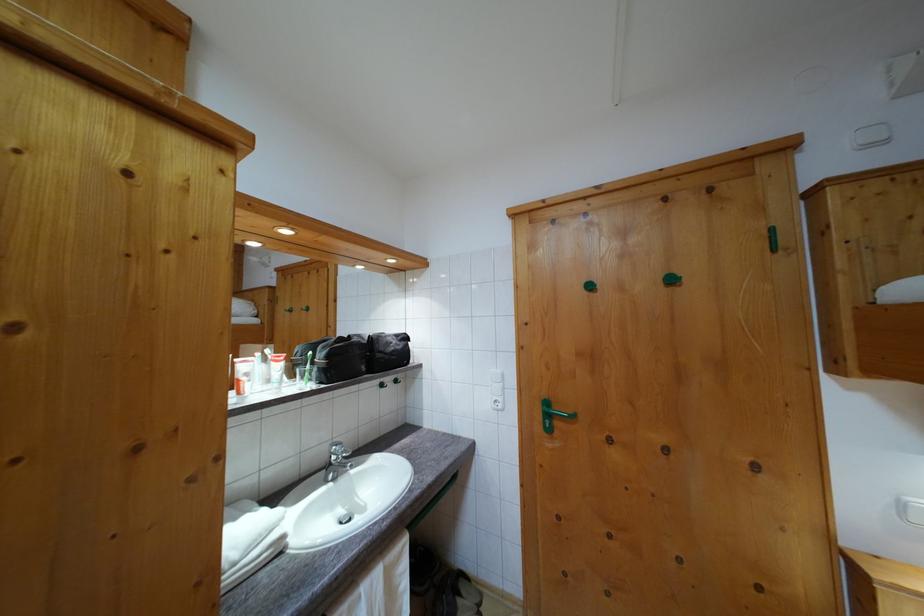
Identify the location of toothpaste tube. This screenshot has width=924, height=616. (265, 363).